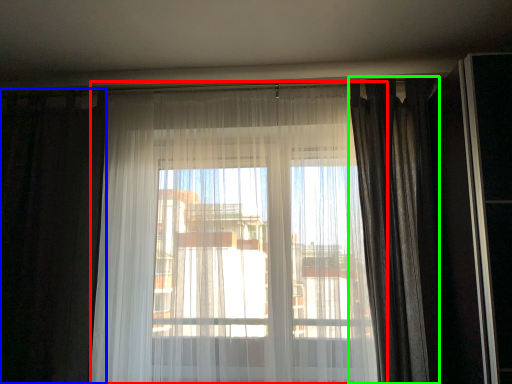
Question: Considering the real-world distances, which object is farthest from curtain (highlighted by a red box)? curtain (highlighted by a blue box) or curtain (highlighted by a green box)?

Choices:
 (A) curtain
 (B) curtain

Answer: (B)